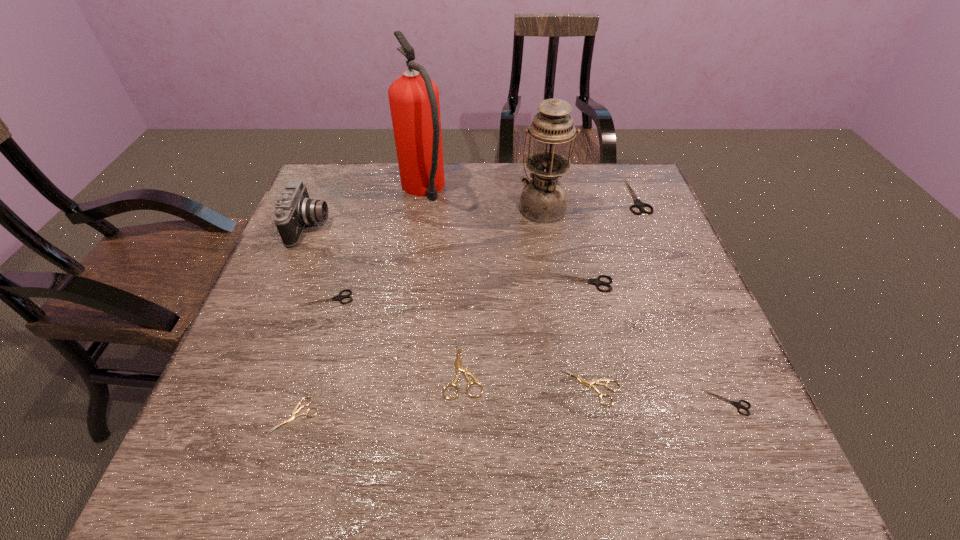
Where is `object positioned at the far left corner`? This screenshot has height=540, width=960. object positioned at the far left corner is located at coordinates (294, 209).

Where is `object located at the far right corner`? This screenshot has width=960, height=540. object located at the far right corner is located at coordinates click(639, 204).

You are a GUI agent. You are given a task and a screenshot of the screen. Output one action in this format:
    pyautogui.click(x=<x>, y=<y>)
    Task: Click on the free location at the far edge of the desktop
    
    Given the screenshot: What is the action you would take?
    pyautogui.click(x=373, y=205)

Locate an element on the screen. Image resolution: width=960 pixels, height=540 pixels. vacant point at the near edge is located at coordinates (313, 442).

Image resolution: width=960 pixels, height=540 pixels. I want to click on vacant area at the left edge, so click(x=288, y=399).

The height and width of the screenshot is (540, 960). In the image, there is a desktop. Identify the location of vacant space at the right edge. (635, 284).

Locate an element on the screen. The height and width of the screenshot is (540, 960). vacant point at the far left corner is located at coordinates (344, 204).

The width and height of the screenshot is (960, 540). I want to click on free space at the near left corner of the desktop, so click(187, 482).

This screenshot has width=960, height=540. In the image, there is a desktop. In order to click on vacant area at the far right corner in this screenshot , I will do `click(592, 176)`.

What are the coordinates of `blank space at the near right corner of the desktop` in the screenshot? It's located at (750, 458).